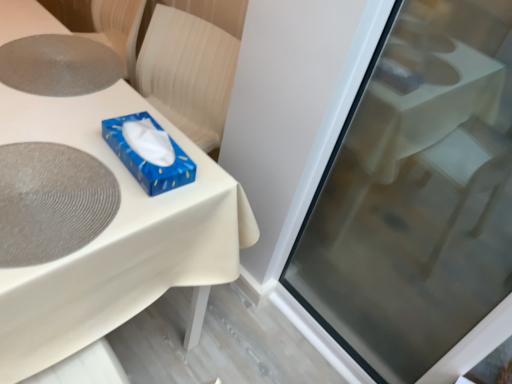
Question: Is transparent glass screen door at upper right positioned behind gray textured placemat at upper left, placed as the 2th oval when sorted from bottom to top?

Choices:
 (A) no
 (B) yes

Answer: (A)

Question: Is transparent glass screen door at upper right directly adjacent to gray textured placemat at upper left, the 1th oval in the top-to-bottom sequence?

Choices:
 (A) yes
 (B) no

Answer: (B)

Question: Is transparent glass screen door at upper right positioned before gray textured placemat at upper left, placed as the 2th oval when sorted from bottom to top?

Choices:
 (A) yes
 (B) no

Answer: (A)

Question: Is transparent glass screen door at upper right thinner than gray textured placemat at upper left, which is the first oval from back to front?

Choices:
 (A) no
 (B) yes

Answer: (B)

Question: Is transparent glass screen door at upper right at the left side of gray textured placemat at upper left, placed as the 2th oval when sorted from bottom to top?

Choices:
 (A) no
 (B) yes

Answer: (A)

Question: In terms of height, does white glossy table at center look taller or shorter compared to blue glossy tissue box at upper center?

Choices:
 (A) tall
 (B) short

Answer: (A)

Question: Is white glossy table at center wider or thinner than blue glossy tissue box at upper center?

Choices:
 (A) wide
 (B) thin

Answer: (A)

Question: From a real-world perspective, is white glossy table at center positioned above or below blue glossy tissue box at upper center?

Choices:
 (A) above
 (B) below

Answer: (B)

Question: Considering the positions of point (56, 380) and point (151, 152), is point (56, 380) closer or farther from the camera than point (151, 152)?

Choices:
 (A) closer
 (B) farther

Answer: (A)

Question: From a real-world perspective, is blue glossy tissue box at upper center above or below transparent glass screen door at upper right?

Choices:
 (A) below
 (B) above

Answer: (B)

Question: In terms of size, does blue glossy tissue box at upper center appear bigger or smaller than transparent glass screen door at upper right?

Choices:
 (A) small
 (B) big

Answer: (A)

Question: Is blue glossy tissue box at upper center taller or shorter than transparent glass screen door at upper right?

Choices:
 (A) short
 (B) tall

Answer: (A)

Question: Looking at their shapes, would you say blue glossy tissue box at upper center is wider or thinner than transparent glass screen door at upper right?

Choices:
 (A) wide
 (B) thin

Answer: (A)

Question: Considering the positions of white glossy table at center and transparent glass screen door at upper right in the image, is white glossy table at center taller or shorter than transparent glass screen door at upper right?

Choices:
 (A) short
 (B) tall

Answer: (A)

Question: Looking at the image, does white glossy table at center seem bigger or smaller compared to transparent glass screen door at upper right?

Choices:
 (A) small
 (B) big

Answer: (B)